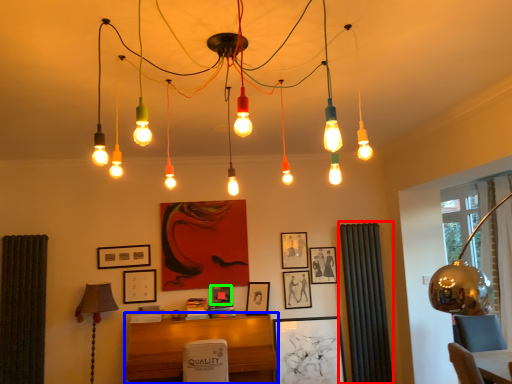
Question: Which is farther away from curtain (highlighted by a red box)? furniture (highlighted by a blue box) or picture frame (highlighted by a green box)?

Choices:
 (A) furniture
 (B) picture frame

Answer: (B)